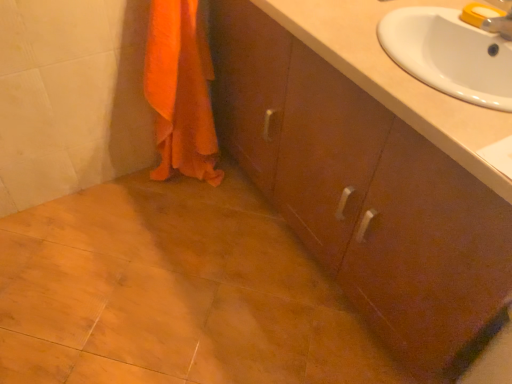
Question: Considering the relative positions of white glossy sink at upper right and brown wood cabinet at center in the image provided, is white glossy sink at upper right to the left or to the right of brown wood cabinet at center?

Choices:
 (A) left
 (B) right

Answer: (B)

Question: In terms of width, does white glossy sink at upper right look wider or thinner when compared to brown wood cabinet at center?

Choices:
 (A) wide
 (B) thin

Answer: (B)

Question: Which object is positioned farthest from the white glossy sink at upper right?

Choices:
 (A) orange fabric towel at lower left
 (B) brown wood cabinet at center

Answer: (A)

Question: Which object is the farthest from the orange fabric towel at lower left?

Choices:
 (A) white glossy sink at upper right
 (B) brown wood cabinet at center

Answer: (A)